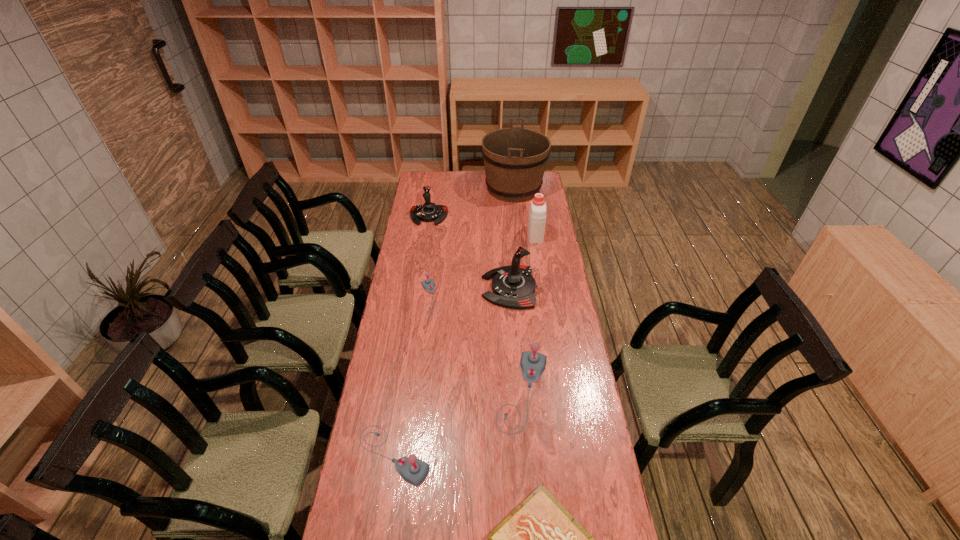
Identify the location of gray joystick that stands as the third closest to the farthest object. The image size is (960, 540). (413, 470).

Where is `gray joystick that stands as the second closest to the tallest joystick`? The image size is (960, 540). gray joystick that stands as the second closest to the tallest joystick is located at coordinates (532, 363).

I want to click on vacant region that satisfies the following two spatial constraints: 1. on the back side of the third shortest joystick; 2. on the handle side of the right red joystick, so (x=515, y=288).

The image size is (960, 540). What are the coordinates of `free space in the image that satisfies the following two spatial constraints: 1. on the handle side of the left red joystick; 2. on the right side of the rightmost gray joystick` in the screenshot? It's located at (402, 392).